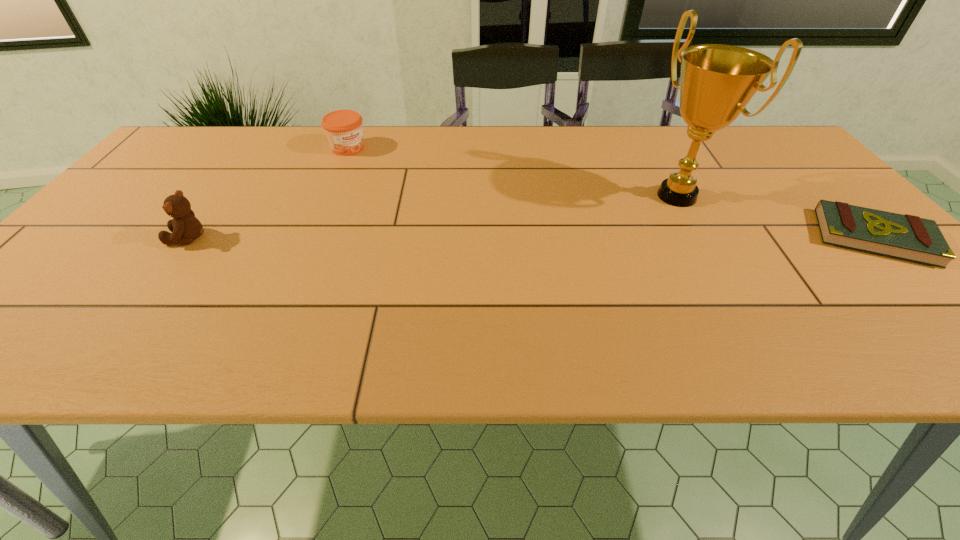
Locate an element on the screen. vacant space in between the third object from left to right and the third tallest object is located at coordinates (513, 172).

Identify the location of free point between the second shortest object and the third object from left to right. The width and height of the screenshot is (960, 540). (513, 172).

This screenshot has height=540, width=960. Find the location of `object that can be found as the third closest to the leftmost object`. object that can be found as the third closest to the leftmost object is located at coordinates (911, 238).

Point out which object is positioned as the third nearest to the jam. Please provide its 2D coordinates. Your answer should be formatted as a tuple, i.e. [(x, y)], where the tuple contains the x and y coordinates of a point satisfying the conditions above.

[(911, 238)]